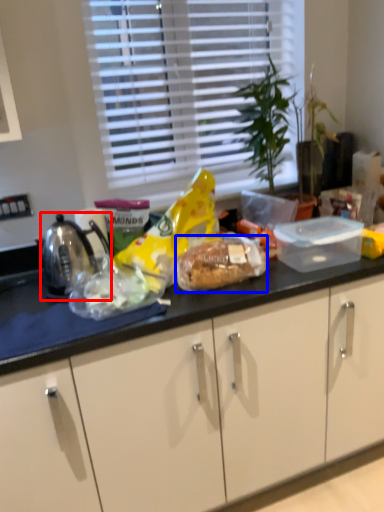
Question: Which of the following is the farthest to the observer, kettle (highlighted by a red box) or snack (highlighted by a blue box)?

Choices:
 (A) kettle
 (B) snack

Answer: (A)